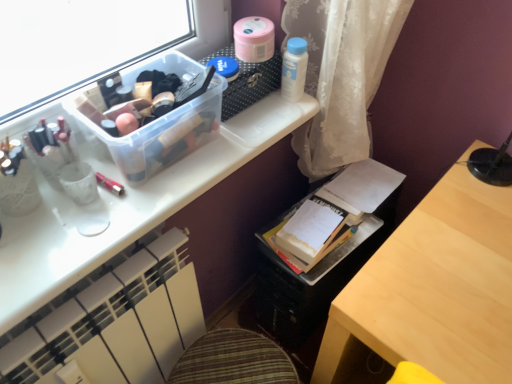
Question: Is metallic pink pen at upper left, the 1th toiletry in the left-to-right sequence, at the back of white plastic bottle at upper right, which is the first toiletry in back-to-front order?

Choices:
 (A) yes
 (B) no

Answer: (B)

Question: Considering the relative positions of white plastic bottle at upper right, which is the 1th toiletry in top-to-bottom order, and metallic pink pen at upper left, the first toiletry positioned from the bottom, in the image provided, is white plastic bottle at upper right, which is the 1th toiletry in top-to-bottom order, to the left of metallic pink pen at upper left, the first toiletry positioned from the bottom, from the viewer's perspective?

Choices:
 (A) yes
 (B) no

Answer: (B)

Question: Considering the relative sizes of white plastic bottle at upper right, the 2th toiletry when ordered from left to right, and metallic pink pen at upper left, the 2th toiletry viewed from the top, in the image provided, is white plastic bottle at upper right, the 2th toiletry when ordered from left to right, wider than metallic pink pen at upper left, the 2th toiletry viewed from the top,?

Choices:
 (A) yes
 (B) no

Answer: (B)

Question: Is metallic pink pen at upper left, the first toiletry positioned from the bottom, a part of white plastic bottle at upper right, which is the first toiletry in back-to-front order?

Choices:
 (A) yes
 (B) no

Answer: (B)

Question: From a real-world perspective, is white plastic bottle at upper right, which is the 1th toiletry in top-to-bottom order, on top of metallic pink pen at upper left, the 2th toiletry viewed from the top?

Choices:
 (A) yes
 (B) no

Answer: (A)

Question: Is matte white desk at upper center taller or shorter than metallic pink pen at upper left, which is counted as the 2th toiletry, starting from the back?

Choices:
 (A) short
 (B) tall

Answer: (B)

Question: In the image, is matte white desk at upper center positioned in front of or behind metallic pink pen at upper left, the first toiletry positioned from the bottom?

Choices:
 (A) behind
 (B) front

Answer: (B)

Question: From a real-world perspective, is matte white desk at upper center positioned above or below metallic pink pen at upper left, which appears as the first toiletry when viewed from the front?

Choices:
 (A) above
 (B) below

Answer: (B)

Question: Looking at their shapes, would you say matte white desk at upper center is wider or thinner than metallic pink pen at upper left, which is counted as the 2th toiletry, starting from the back?

Choices:
 (A) wide
 (B) thin

Answer: (A)

Question: Is white plastic bottle at upper right, which is the first toiletry in back-to-front order, situated inside metallic pink pen at upper left, the second toiletry from the right, or outside?

Choices:
 (A) outside
 (B) inside

Answer: (A)

Question: Does point (289, 39) appear closer or farther from the camera than point (122, 190)?

Choices:
 (A) farther
 (B) closer

Answer: (A)

Question: Considering the positions of white plastic bottle at upper right, acting as the 2th toiletry starting from the front, and metallic pink pen at upper left, which appears as the first toiletry when viewed from the front, in the image, is white plastic bottle at upper right, acting as the 2th toiletry starting from the front, bigger or smaller than metallic pink pen at upper left, which appears as the first toiletry when viewed from the front,?

Choices:
 (A) big
 (B) small

Answer: (A)

Question: Is white plastic bottle at upper right, which is the 1th toiletry in top-to-bottom order, in front of or behind metallic pink pen at upper left, the first toiletry positioned from the bottom, in the image?

Choices:
 (A) front
 (B) behind

Answer: (B)

Question: Is white paper book at center wider or thinner than white plastic bottle at upper right, the 2th toiletry ordered from the bottom?

Choices:
 (A) thin
 (B) wide

Answer: (B)

Question: From a real-world perspective, is white paper book at center above or below white plastic bottle at upper right, the 2th toiletry when ordered from left to right?

Choices:
 (A) above
 (B) below

Answer: (B)